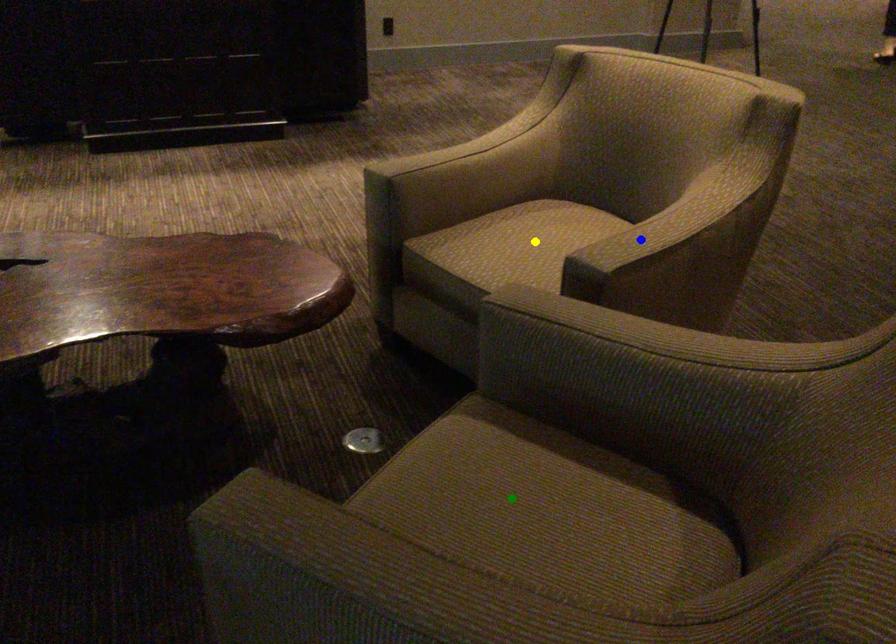
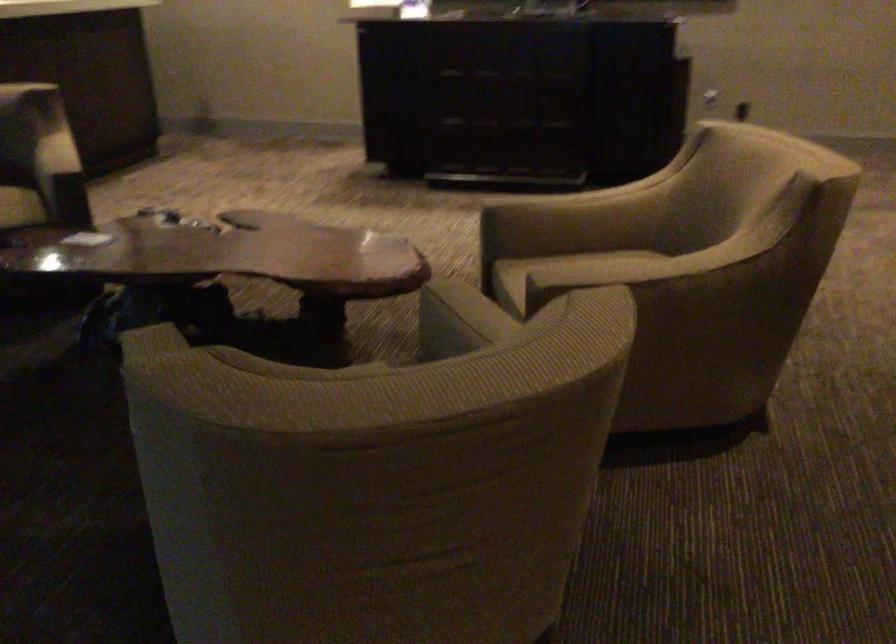
I am providing you with two images of the same scene from different viewpoints. Three points are marked in image1. Which point corresponds to a part or object that is occluded in image2?In image1, three points are marked. Which of them correspond to a part or object that is occluded in image2?Among the three points shown in image1, which one corresponds to a part or object that is no longer visible due to occlusion in image2?

yellow point, green point